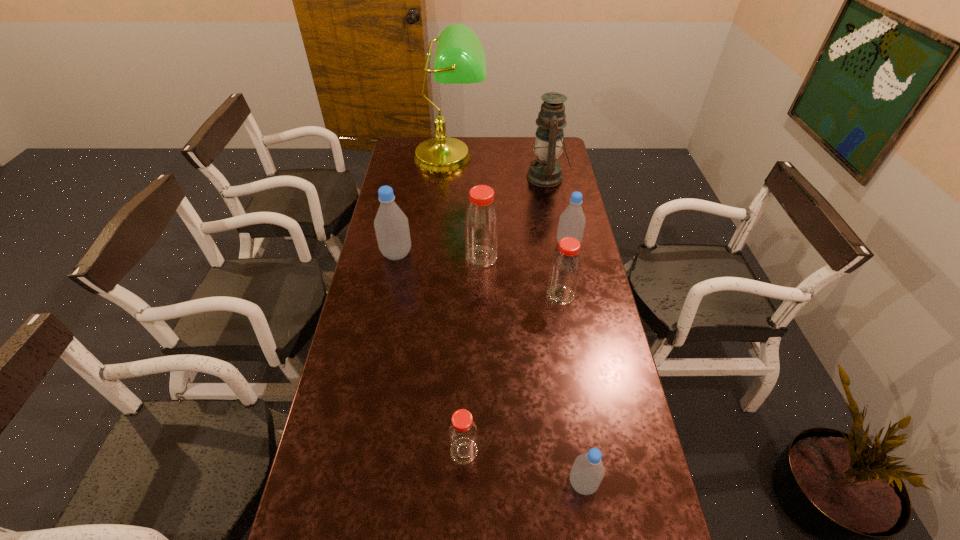
Find the location of a particular element. This screenshot has width=960, height=540. the nearest gray bottle is located at coordinates pos(587,472).

The image size is (960, 540). Identify the location of the smallest gray bottle. (587, 472).

Where is `the nearest red bottle`? The width and height of the screenshot is (960, 540). the nearest red bottle is located at coordinates (462, 434).

Image resolution: width=960 pixels, height=540 pixels. Find the location of `the second nearest object`. the second nearest object is located at coordinates (x=462, y=434).

Locate an element on the screen. vacant space located 0.170m on the desk next to the green lamp is located at coordinates (445, 203).

Find the location of `vacant space located on the left of the oil lamp`. vacant space located on the left of the oil lamp is located at coordinates point(494,177).

Where is `free space located on the front of the farthest red bottle`? The width and height of the screenshot is (960, 540). free space located on the front of the farthest red bottle is located at coordinates (482, 355).

At what (x,y) coordinates should I click in order to perform the action: click on vacant region located 0.150m on the front of the biggest gray bottle. Please return your answer as a coordinate pair (x, y). Image resolution: width=960 pixels, height=540 pixels. Looking at the image, I should click on (389, 295).

Locate an element on the screen. The height and width of the screenshot is (540, 960). free region located 0.320m on the left of the third nearest bottle is located at coordinates (454, 295).

You are a GUI agent. You are given a task and a screenshot of the screen. Output one action in this format:
    pyautogui.click(x=<x>, y=<y>)
    Task: Click on the free point located on the back of the rightmost gray bottle
    
    Given the screenshot: What is the action you would take?
    pyautogui.click(x=558, y=193)